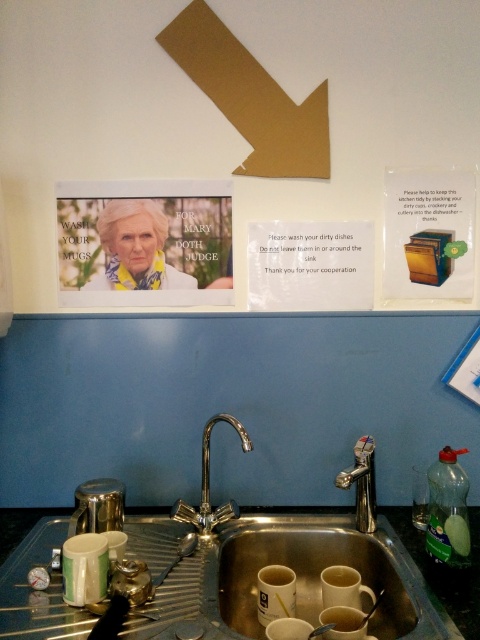
Question: Does gold cardboard arrow at upper center have a greater width compared to silver/metallic faucet at sink center?

Choices:
 (A) no
 (B) yes

Answer: (B)

Question: Can you confirm if granite dark gray counter top at sink is bigger than silver/metallic faucet at sink center?

Choices:
 (A) yes
 (B) no

Answer: (A)

Question: Which of the following is the farthest from the observer?

Choices:
 (A) (468, 589)
 (B) (228, 84)
 (C) (204, 445)

Answer: (C)

Question: Which point is closer to the camera?

Choices:
 (A) (69, 512)
 (B) (304, 573)

Answer: (B)

Question: Is silver metallic sink at center positioned before gold cardboard arrow at upper center?

Choices:
 (A) no
 (B) yes

Answer: (B)

Question: Which of the following is the farthest from the observer?

Choices:
 (A) (200, 529)
 (B) (248, 170)

Answer: (B)